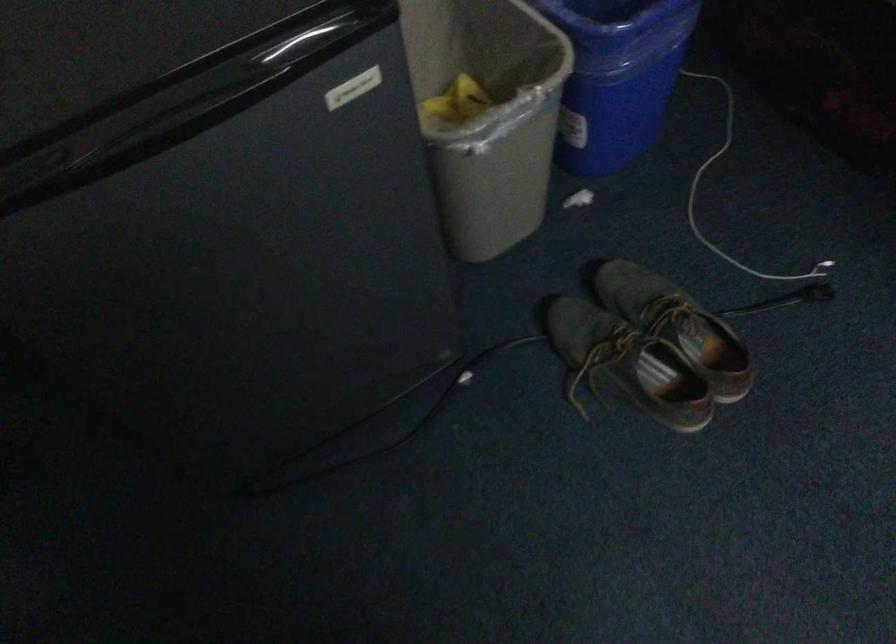
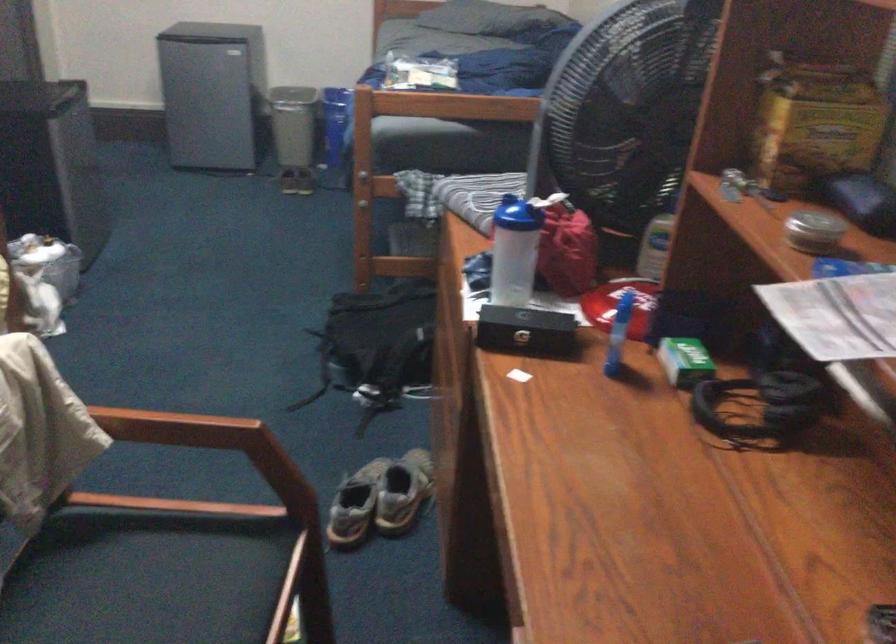
Question: I am providing you with two images of the same scene from different viewpoints. After the viewpoint changes to image2, which objects are now occluded?

Choices:
 (A) green picture frame
 (B) wooden chair armrest
 (C) white cable connector
 (D) round metal tin

Answer: (C)